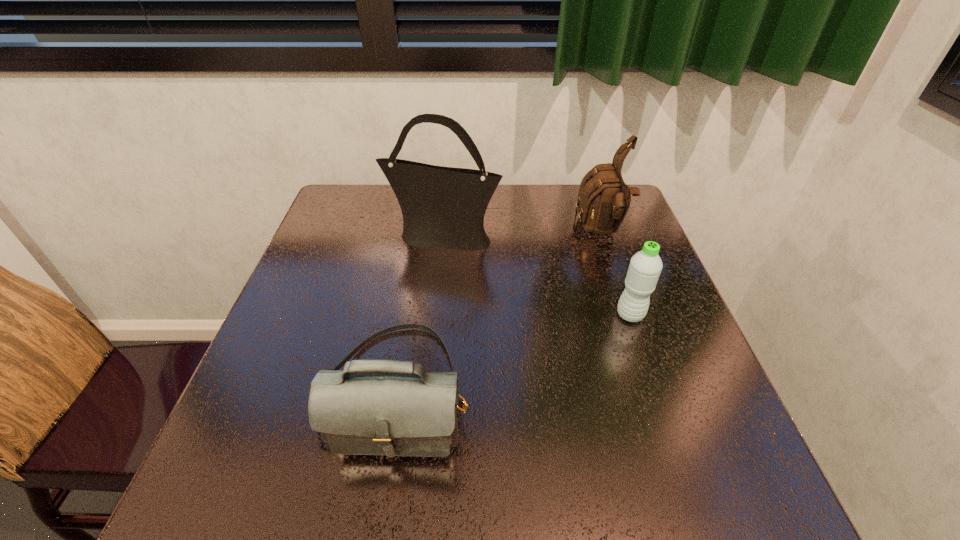
This screenshot has width=960, height=540. Find the location of `free region at the left edge`. free region at the left edge is located at coordinates (274, 331).

Locate an element on the screen. vacant area at the right edge is located at coordinates (614, 246).

Where is `vacant space at the far left corner of the desktop`? This screenshot has height=540, width=960. vacant space at the far left corner of the desktop is located at coordinates (363, 225).

In order to click on unoccupied position between the tallest object and the second tallest object in this screenshot , I will do `click(522, 234)`.

Where is `free space between the water bottle and the nearest shoulder bag`? This screenshot has height=540, width=960. free space between the water bottle and the nearest shoulder bag is located at coordinates (515, 353).

Where is `empty location between the nearest shoulder bag and the tallest object`? This screenshot has height=540, width=960. empty location between the nearest shoulder bag and the tallest object is located at coordinates (420, 313).

The height and width of the screenshot is (540, 960). Identify the location of free area in between the water bottle and the nearest shoulder bag. (515, 353).

Locate an element on the screen. The height and width of the screenshot is (540, 960). vacant space that's between the third farthest object and the tallest shoulder bag is located at coordinates (537, 276).

Find the location of a particular element. Image resolution: width=960 pixels, height=540 pixels. vacant area that lies between the second nearest object and the nearest object is located at coordinates (515, 353).

The image size is (960, 540). Find the location of `vacant space that's between the tallest object and the nearest object`. vacant space that's between the tallest object and the nearest object is located at coordinates tap(420, 313).